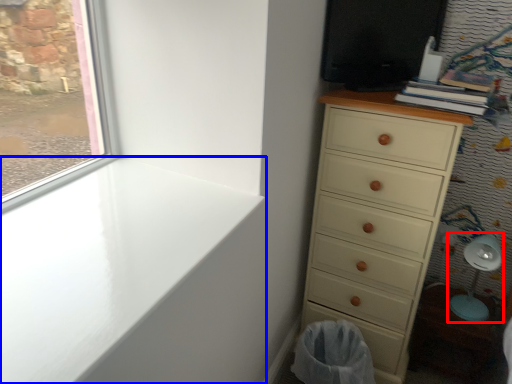
Question: Which object is closer to the camera taking this photo, swivel chair (highlighted by a red box) or window sill (highlighted by a blue box)?

Choices:
 (A) swivel chair
 (B) window sill

Answer: (B)